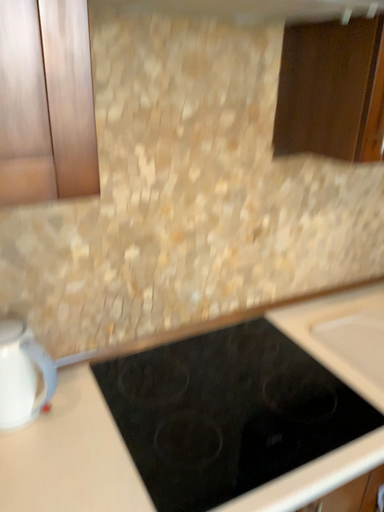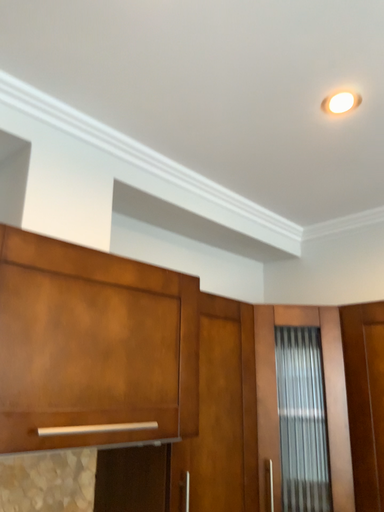
Question: How did the camera likely rotate when shooting the video?

Choices:
 (A) rotated upward
 (B) rotated downward

Answer: (A)